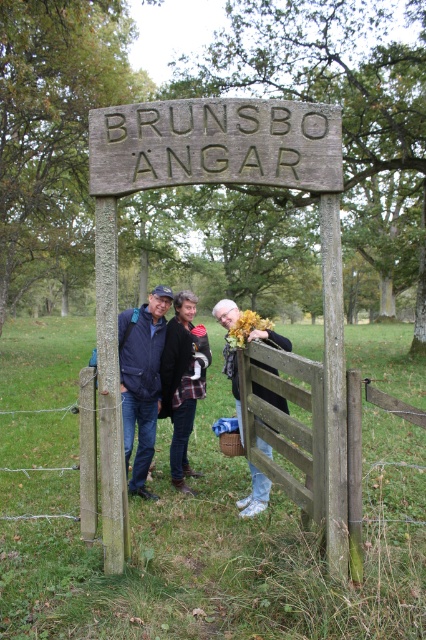
You are a photographer standing 5 meters away from the plaid fabric jacket at center. You want to take a photo of it. Is the jacket within your camera range if your camera can focus up to 5 meters?

The plaid fabric jacket at center is 4.91 meters away from the camera, which is within the 5 meters focusing range. Therefore, the camera can focus on the plaid fabric jacket at center.

You are a photographer setting up a shot of the weathered wood sign at center and the leather jacket at center. Based on their heights, which object should you focus on first if you want to ensure both are in frame without adjusting your camera angle?

The weathered wood sign at center is shorter than the leather jacket at center, so you should focus on the leather jacket at center first to ensure both are in frame.

Consider the image. You are taking a photo of the weathered wood sign at center and the leather jacket at center. Which object should you focus on first if you want to capture both in sharp focus?

The weathered wood sign at center is closer to the viewer than the leather jacket at center. To capture both in sharp focus, you should focus on the weathered wood sign at center first since it is closer, ensuring depth of field includes both objects.